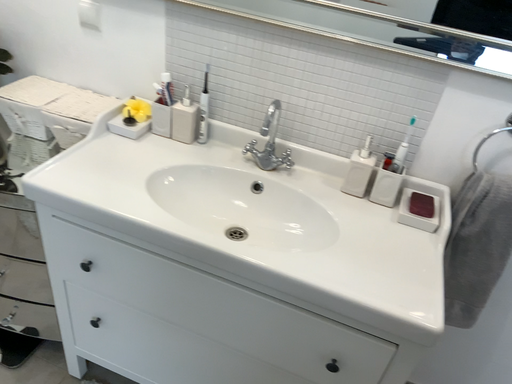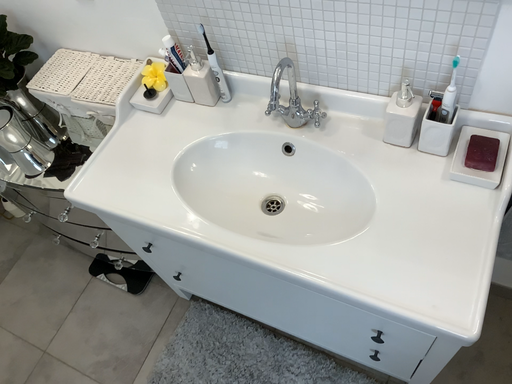
Question: How did the camera likely rotate when shooting the video?

Choices:
 (A) rotated downward
 (B) rotated upward

Answer: (A)